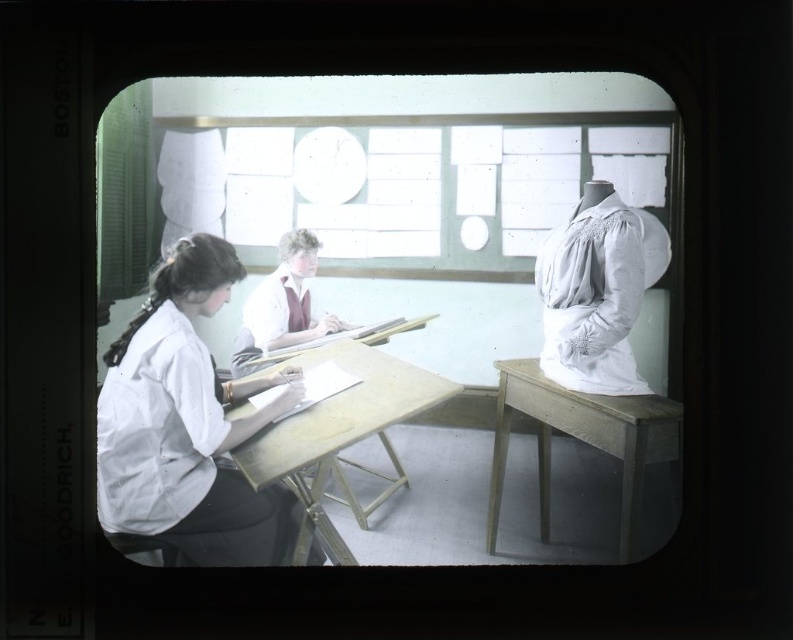
Looking at this image, you are observing a vintage photograph of two people seated at a drafting table. Both are wearing the white cotton blouse at left and the white cotton blouse at right. Based on their positions in the image, which blouse appears closer to the bottom edge of the photograph?

The white cotton blouse at left appears closer to the bottom edge of the photograph because it is positioned below the white cotton blouse at right.

You are standing in front of the vintage photograph described. You want to know how far the wooden table at center is from your viewpoint. Can you determine this distance based on the information provided?

The wooden table at center is 4.16 feet away from the camera, so if you are standing in front of the photograph, the depicted distance would be 4.16 feet as per the image data.

You are a student who needs to place a tall stack of books on a table. Based on the scene, which table between the wooden table at center and the wooden table at right would be more suitable for the stack?

The wooden table at center is taller than the wooden table at right, so it would be more suitable for placing a tall stack of books since it offers more vertical space.